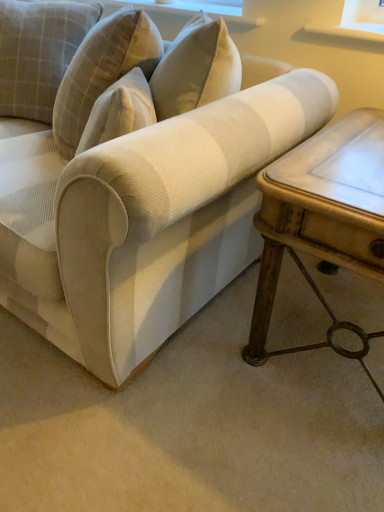
At what (x,y) coordinates should I click in order to perform the action: click on plaid fabric pillow at upper left. Please return your answer as a coordinate pair (x, y). Looking at the image, I should click on (38, 52).

Considering the relative positions of plaid fabric pillow at upper left and white marble table at right in the image provided, is plaid fabric pillow at upper left to the right of white marble table at right from the viewer's perspective?

No, plaid fabric pillow at upper left is not to the right of white marble table at right.

Is plaid fabric pillow at upper left smaller than white marble table at right?

Indeed, plaid fabric pillow at upper left has a smaller size compared to white marble table at right.

From the image's perspective, would you say plaid fabric pillow at upper left is shown under white marble table at right?

Incorrect, from the image's perspective, plaid fabric pillow at upper left is higher than white marble table at right.

Is plaid fabric pillow at upper left oriented towards white marble table at right?

No, plaid fabric pillow at upper left does not turn towards white marble table at right.

How different are the orientations of white textured fabric couch at center and plaid fabric pillow at upper left in degrees?

32.1 degrees.

Is white textured fabric couch at center closer to camera compared to plaid fabric pillow at upper left?

Yes, the depth of white textured fabric couch at center is less than that of plaid fabric pillow at upper left.

The width and height of the screenshot is (384, 512). I want to click on pillow above the white textured fabric couch at center (from the image's perspective), so click(x=38, y=52).

Considering the relative positions of white textured fabric couch at center and plaid fabric pillow at upper left in the image provided, is white textured fabric couch at center to the left or to the right of plaid fabric pillow at upper left?

In the image, white textured fabric couch at center appears on the right side of plaid fabric pillow at upper left.

Can you confirm if white marble table at right is bigger than white textured fabric couch at center?

No.

From a real-world perspective, which object rests below the other?

white marble table at right is physically lower.

Looking at this image, is white marble table at right positioned before white textured fabric couch at center?

No, the depth of white marble table at right is greater than that of white textured fabric couch at center.

From the image's perspective, is plaid fabric pillow at upper left located beneath white textured fabric couch at center?

No, from the image's perspective, plaid fabric pillow at upper left is not below white textured fabric couch at center.

What's the angular difference between plaid fabric pillow at upper left and white textured fabric couch at center's facing directions?

32.1 degrees separate the facing orientations of plaid fabric pillow at upper left and white textured fabric couch at center.

Considering the relative sizes of plaid fabric pillow at upper left and white textured fabric couch at center in the image provided, is plaid fabric pillow at upper left smaller than white textured fabric couch at center?

Yes, plaid fabric pillow at upper left is smaller than white textured fabric couch at center.

Is plaid fabric pillow at upper left not within white textured fabric couch at center?

Actually, plaid fabric pillow at upper left is at least partially inside white textured fabric couch at center.

Is white textured fabric couch at center facing towards white marble table at right?

No, white textured fabric couch at center is not facing towards white marble table at right.

Looking at this image, which of these two, white textured fabric couch at center or white marble table at right, stands shorter?

With less height is white marble table at right.

Which object is wider, white textured fabric couch at center or white marble table at right?

Wider between the two is white textured fabric couch at center.

In terms of size, does white marble table at right appear bigger or smaller than plaid fabric pillow at upper left?

In the image, white marble table at right appears to be larger than plaid fabric pillow at upper left.

Between white marble table at right and plaid fabric pillow at upper left, which one has smaller width?

plaid fabric pillow at upper left.

What's the angular difference between white marble table at right and plaid fabric pillow at upper left's facing directions?

There is a 30.1-degree angle between the facing directions of white marble table at right and plaid fabric pillow at upper left.

Which point is more forward, (x=334, y=194) or (x=20, y=28)?

Positioned in front is point (x=334, y=194).

Where is `table that appears below the plaid fabric pillow at upper left (from a real-world perspective)`? table that appears below the plaid fabric pillow at upper left (from a real-world perspective) is located at coordinates (323, 221).

Identify the location of studio couch below the plaid fabric pillow at upper left (from the image's perspective). (145, 216).

When comparing their distances from white marble table at right, does white textured fabric couch at center or plaid fabric pillow at upper left seem further?

plaid fabric pillow at upper left lies further to white marble table at right than the other object.

From the image, which object appears to be farther from white marble table at right, plaid fabric pillow at upper left or white textured fabric couch at center?

Among the two, plaid fabric pillow at upper left is located further to white marble table at right.

When comparing their distances from plaid fabric pillow at upper left, does white marble table at right or white textured fabric couch at center seem closer?

The object closer to plaid fabric pillow at upper left is white textured fabric couch at center.

From the picture: Looking at the image, which one is located further to white textured fabric couch at center, white marble table at right or plaid fabric pillow at upper left?

Based on the image, plaid fabric pillow at upper left appears to be further to white textured fabric couch at center.

Looking at the image, which one is located further to white textured fabric couch at center, plaid fabric pillow at upper left or white marble table at right?

plaid fabric pillow at upper left.

Consider the image. When comparing their distances from plaid fabric pillow at upper left, does white textured fabric couch at center or white marble table at right seem further?

white marble table at right lies further to plaid fabric pillow at upper left than the other object.

Image resolution: width=384 pixels, height=512 pixels. What are the coordinates of `studio couch between plaid fabric pillow at upper left and white marble table at right from left to right` in the screenshot? It's located at (145, 216).